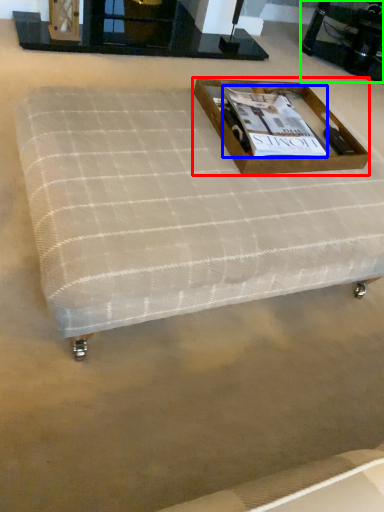
Question: Estimate the real-world distances between objects in this image. Which object is closer to box (highlighted by a red box), magazine (highlighted by a blue box) or round table (highlighted by a green box)?

Choices:
 (A) magazine
 (B) round table

Answer: (A)